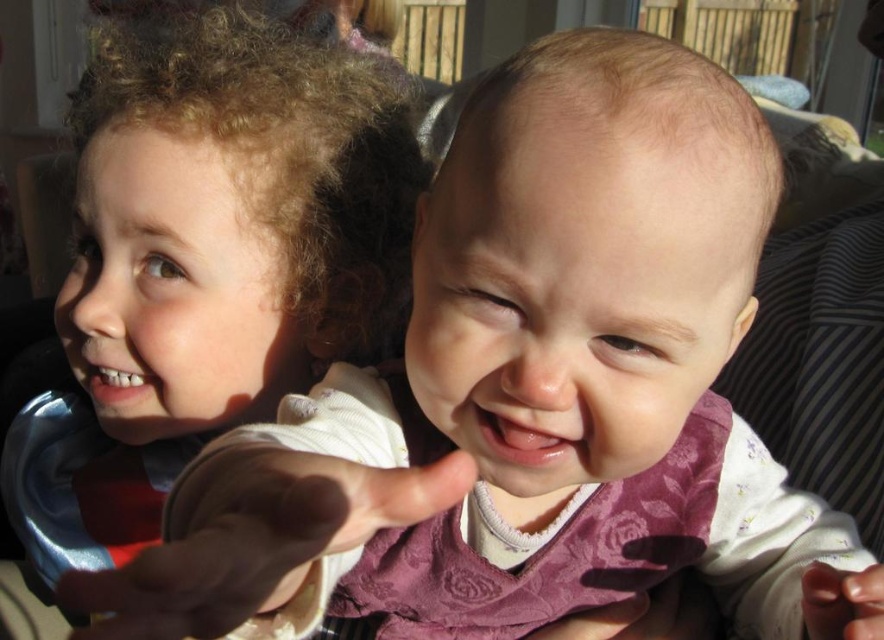
Which is above, curly hair at upper left or smooth white hand at center?

curly hair at upper left

Between curly hair at upper left and smooth white hand at center, which one has less height?

With less height is smooth white hand at center.

Measure the distance between curly hair at upper left and camera.

curly hair at upper left is 21.89 inches away from camera.

I want to click on curly hair at upper left, so click(211, 257).

Does smooth white hand at center have a greater width compared to smooth skin hand at center?

Indeed, smooth white hand at center has a greater width compared to smooth skin hand at center.

I want to click on smooth white hand at center, so click(254, 538).

You are a GUI agent. You are given a task and a screenshot of the screen. Output one action in this format:
    pyautogui.click(x=<x>, y=<y>)
    Task: Click on the smooth white hand at center
    Image resolution: width=884 pixels, height=640 pixels.
    Given the screenshot: What is the action you would take?
    pyautogui.click(x=254, y=538)

Between curly hair at upper left and smooth skin hand at center, which one has less height?

smooth skin hand at center is shorter.

The width and height of the screenshot is (884, 640). In order to click on curly hair at upper left in this screenshot , I will do `click(211, 257)`.